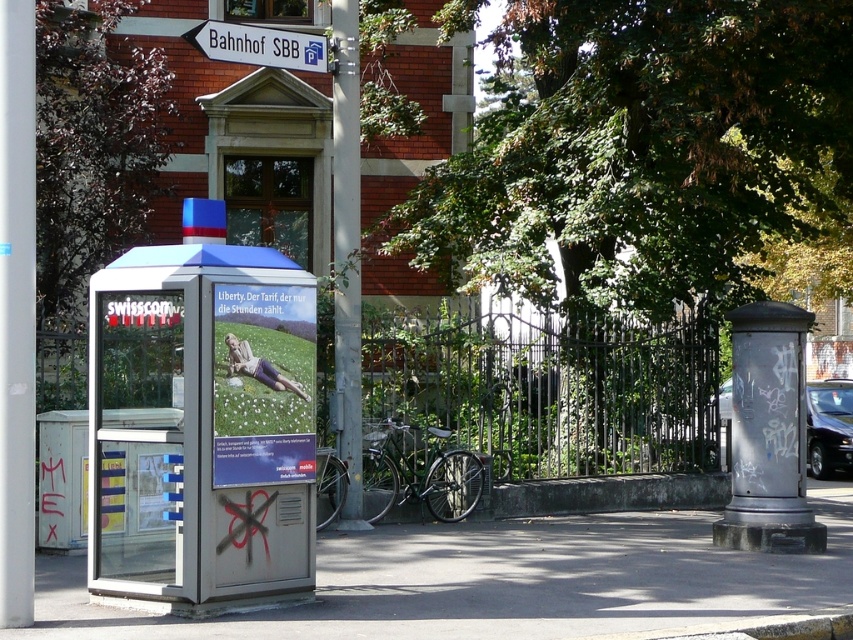
Does metallic silver bus stop at left have a larger size compared to white plastic sign at upper center?

Yes.

Does metallic silver bus stop at left have a lesser width compared to white plastic sign at upper center?

No, metallic silver bus stop at left is not thinner than white plastic sign at upper center.

What do you see at coordinates (201, 424) in the screenshot?
I see `metallic silver bus stop at left` at bounding box center [201, 424].

Identify the location of metallic silver bus stop at left. (201, 424).

Is metallic silver bus stop at left shorter than metallic gray pole at center?

Yes, metallic silver bus stop at left is shorter than metallic gray pole at center.

Is metallic silver bus stop at left thinner than metallic gray pole at center?

Incorrect, metallic silver bus stop at left's width is not less than metallic gray pole at center's.

Is point (236, 394) farther from viewer compared to point (351, 19)?

No, it is not.

I want to click on metallic silver bus stop at left, so click(201, 424).

Does point (474, 374) lie behind point (358, 269)?

Yes.

Is green wrought iron fence at center bigger than metallic gray pole at center?

Correct, green wrought iron fence at center is larger in size than metallic gray pole at center.

Is point (444, 397) closer to viewer compared to point (358, 356)?

No, it is not.

The width and height of the screenshot is (853, 640). Find the location of `green wrought iron fence at center`. green wrought iron fence at center is located at coordinates (554, 388).